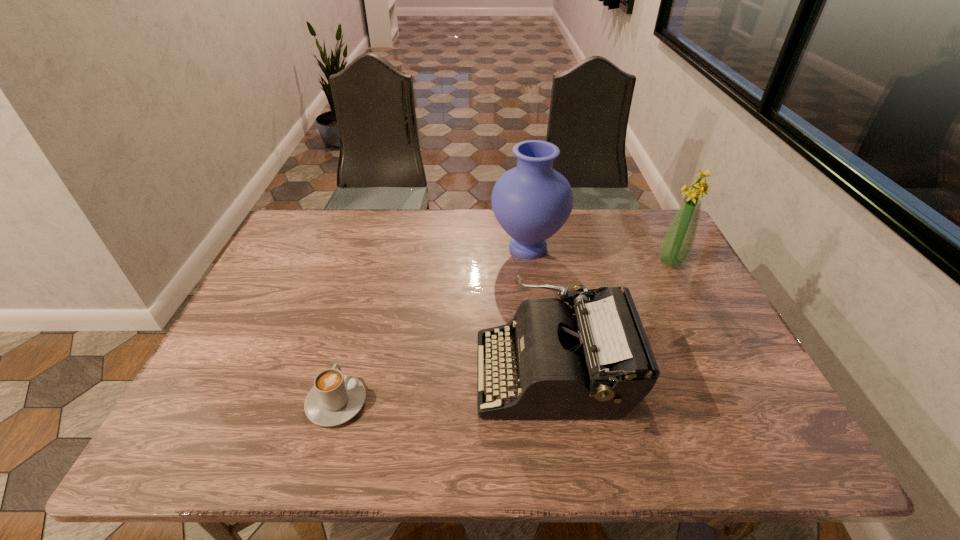
Where is `vacant region at the near edge`? This screenshot has width=960, height=540. vacant region at the near edge is located at coordinates (399, 433).

In the image, there is a desktop. Find the location of `free space at the left edge`. free space at the left edge is located at coordinates (236, 379).

I want to click on blank area at the right edge, so [x=748, y=369].

Find the location of a particular element. free space at the far left corner of the desktop is located at coordinates (337, 209).

I want to click on vacant space at the far right corner of the desktop, so coord(632,232).

This screenshot has height=540, width=960. Identify the location of vacant space in between the typewriter and the leftmost object. (444, 388).

Find the location of `free area in between the rightmost object and the vase`. free area in between the rightmost object and the vase is located at coordinates (599, 255).

Locate an element on the screen. The height and width of the screenshot is (540, 960). empty space that is in between the typewriter and the cappuccino is located at coordinates (444, 388).

Identify the location of free space between the vase and the shortest object. The width and height of the screenshot is (960, 540). (432, 325).

Where is `free space that is in between the shortest object and the typewriter`? free space that is in between the shortest object and the typewriter is located at coordinates (444, 388).